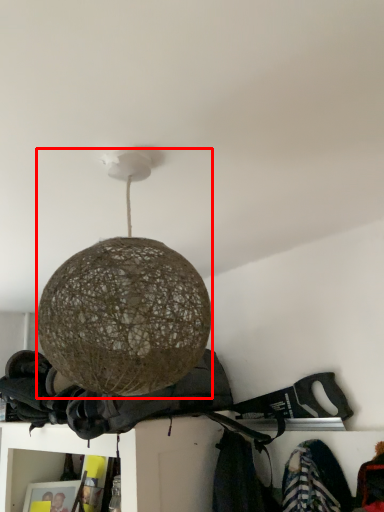
Question: Considering the relative positions of lamp (annotated by the red box) and clothing in the image provided, where is lamp (annotated by the red box) located with respect to the staircase?

Choices:
 (A) left
 (B) right

Answer: (B)